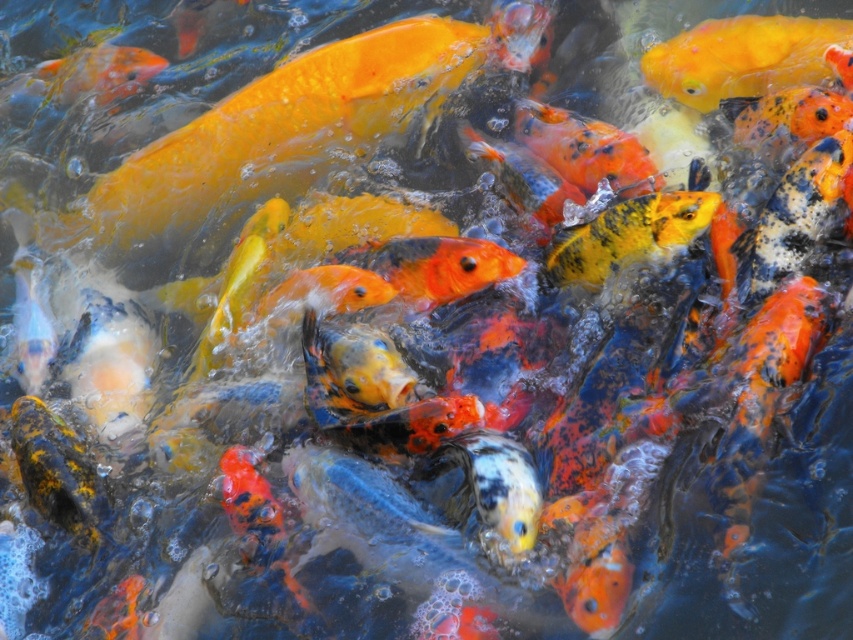
Is shiny orange fish at upper right further to camera compared to yellow speckled fish at center?

Yes, it is behind yellow speckled fish at center.

Is point (659, 44) closer to viewer compared to point (669, 193)?

No, it is not.

Locate an element on the screen. The width and height of the screenshot is (853, 640). shiny orange fish at upper right is located at coordinates (741, 58).

Which is above, yellow speckled fish at center or orange glossy fish at upper left?

orange glossy fish at upper left is above.

Does yellow speckled fish at center appear under orange glossy fish at upper left?

Yes, yellow speckled fish at center is below orange glossy fish at upper left.

Is point (573, 256) farther from viewer compared to point (144, 54)?

No.

Image resolution: width=853 pixels, height=640 pixels. In order to click on yellow speckled fish at center in this screenshot , I will do `click(628, 236)`.

Describe the element at coordinates (741, 58) in the screenshot. I see `shiny orange fish at upper right` at that location.

Is shiny orange fish at upper right smaller than orange glossy fish at upper left?

Incorrect, shiny orange fish at upper right is not smaller in size than orange glossy fish at upper left.

Between point (665, 56) and point (102, 76), which one is positioned in front?

Point (665, 56)

At what (x,y) coordinates should I click in order to perform the action: click on shiny orange fish at upper right. Please return your answer as a coordinate pair (x, y). The width and height of the screenshot is (853, 640). Looking at the image, I should click on (741, 58).